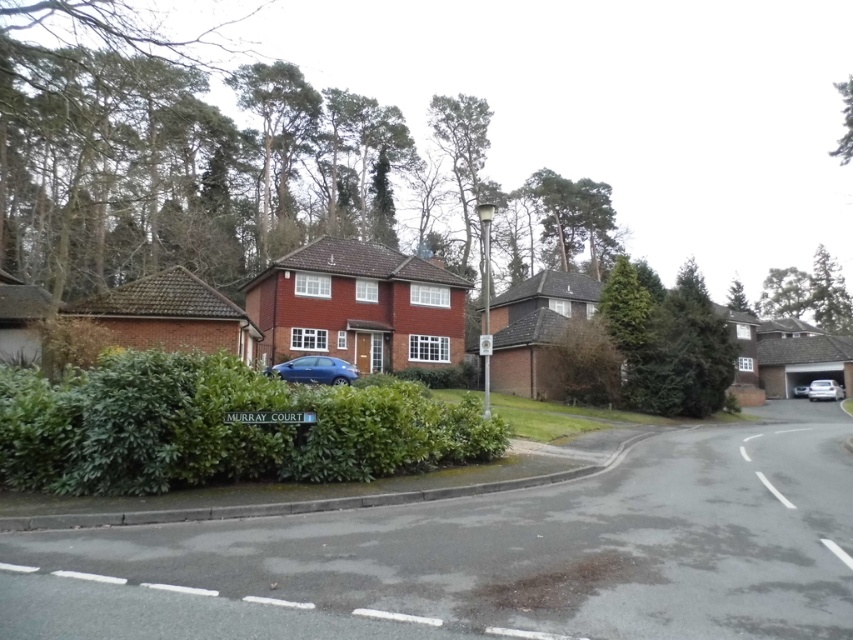
You are standing at the entrance of Murray Court and want to locate two specific points marked on the property. The first point is at coordinates point (13, 452) and the second is at point (830, 388). Which point is closer to the entrance?

A: Point (13, 452) is in front of point (830, 388), so the first point is closer to the entrance.

You are standing at the entrance of Murray Court and want to find the green leafy hedge at center. Based on its coordinates, can you tell me in which direction from the entrance it is located?

The green leafy hedge at center is located at coordinates point (219, 428). Since the entrance is at the lower left corner of the image, the hedge is to the upper right direction from the entrance.

You are a delivery person needing to park your van between the glossy blue car at center and the silver metallic car at right. Your van is 6 meters long. Can you fit your van between them without moving either car?

The distance between the glossy blue car at center and the silver metallic car at right is 35.27 meters. Since your van is only 6 meters long, there is sufficient space to park it between them without moving either car.